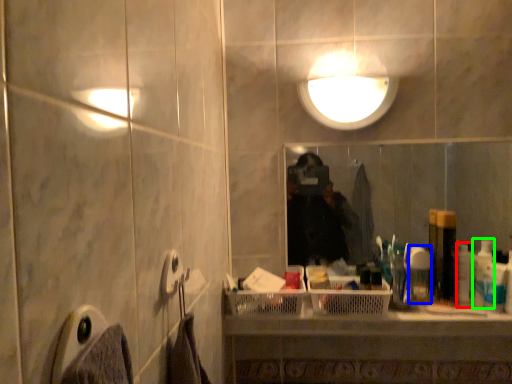
Question: Which object is the farthest from toiletry (highlighted by a red box)? Choose among these: toiletry (highlighted by a blue box) or toiletry (highlighted by a green box).

Choices:
 (A) toiletry
 (B) toiletry

Answer: (A)